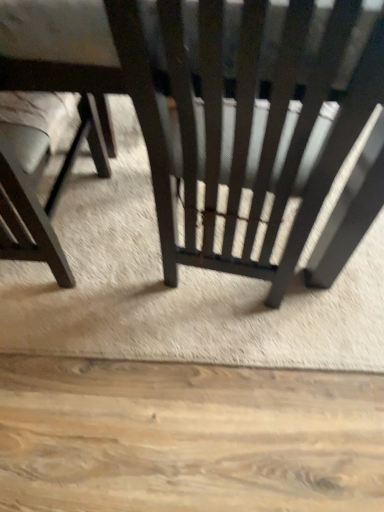
Where is `matte black chair at center, the 2th chair viewed from the left`? The image size is (384, 512). matte black chair at center, the 2th chair viewed from the left is located at coordinates (227, 110).

The height and width of the screenshot is (512, 384). What do you see at coordinates (227, 110) in the screenshot?
I see `matte black chair at center, the 1th chair positioned from the right` at bounding box center [227, 110].

Measure the distance between matte black chair at center, the 1th chair positioned from the right, and camera.

40.68 centimeters.

Where is `matte black chair at left, arranged as the 2th chair when viewed from the right`? This screenshot has width=384, height=512. matte black chair at left, arranged as the 2th chair when viewed from the right is located at coordinates (36, 185).

How much space does matte black chair at left, arranged as the 2th chair when viewed from the right, occupy vertically?

The height of matte black chair at left, arranged as the 2th chair when viewed from the right, is 56.40 centimeters.

What do you see at coordinates (36, 185) in the screenshot?
I see `matte black chair at left, the 1th chair from the left` at bounding box center [36, 185].

Find the location of a particular element. matte black chair at center, the 2th chair viewed from the left is located at coordinates (227, 110).

Is matte black chair at left, the 1th chair from the left, at the right side of matte black chair at center, the 1th chair positioned from the right?

No, matte black chair at left, the 1th chair from the left, is not to the right of matte black chair at center, the 1th chair positioned from the right.

Considering the relative positions of matte black chair at left, the 1th chair from the left, and matte black chair at center, the 2th chair viewed from the left, in the image provided, is matte black chair at left, the 1th chair from the left, behind matte black chair at center, the 2th chair viewed from the left,?

Yes, it is.

Does point (45, 237) appear closer or farther from the camera than point (35, 28)?

Clearly, point (45, 237) is more distant from the camera than point (35, 28).

From the image's perspective, who appears lower, matte black chair at left, the 1th chair from the left, or matte black chair at center, the 2th chair viewed from the left?

matte black chair at left, the 1th chair from the left, appears lower in the image.

From a real-world perspective, is matte black chair at left, arranged as the 2th chair when viewed from the right, positioned under matte black chair at center, the 1th chair positioned from the right, based on gravity?

Correct, in the physical world, matte black chair at left, arranged as the 2th chair when viewed from the right, is lower than matte black chair at center, the 1th chair positioned from the right.

In terms of width, does matte black chair at left, arranged as the 2th chair when viewed from the right, look wider or thinner when compared to matte black chair at center, the 1th chair positioned from the right?

matte black chair at left, arranged as the 2th chair when viewed from the right, is thinner than matte black chair at center, the 1th chair positioned from the right.

Based on the photo, in terms of height, does matte black chair at left, arranged as the 2th chair when viewed from the right, look taller or shorter compared to matte black chair at center, the 2th chair viewed from the left?

Clearly, matte black chair at left, arranged as the 2th chair when viewed from the right, is shorter compared to matte black chair at center, the 2th chair viewed from the left.

From the picture: Based on their sizes in the image, would you say matte black chair at left, arranged as the 2th chair when viewed from the right, is bigger or smaller than matte black chair at center, the 2th chair viewed from the left?

In the image, matte black chair at left, arranged as the 2th chair when viewed from the right, appears to be smaller than matte black chair at center, the 2th chair viewed from the left.

Is matte black chair at left, arranged as the 2th chair when viewed from the right, located outside matte black chair at center, the 2th chair viewed from the left?

No, matte black chair at left, arranged as the 2th chair when viewed from the right, is not entirely external to matte black chair at center, the 2th chair viewed from the left.

Is matte black chair at left, arranged as the 2th chair when viewed from the right, positioned far away from matte black chair at center, the 2th chair viewed from the left?

No, matte black chair at left, arranged as the 2th chair when viewed from the right, is in close proximity to matte black chair at center, the 2th chair viewed from the left.

Is matte black chair at left, the 1th chair from the left, positioned with its back to matte black chair at center, the 1th chair positioned from the right?

That's right, matte black chair at left, the 1th chair from the left, is facing away from matte black chair at center, the 1th chair positioned from the right.

This screenshot has height=512, width=384. Find the location of `chair below the matte black chair at center, the 1th chair positioned from the right (from the image's perspective)`. chair below the matte black chair at center, the 1th chair positioned from the right (from the image's perspective) is located at coordinates (36, 185).

Visually, is matte black chair at center, the 1th chair positioned from the right, positioned to the left or to the right of matte black chair at left, arranged as the 2th chair when viewed from the right?

matte black chair at center, the 1th chair positioned from the right, is to the right of matte black chair at left, arranged as the 2th chair when viewed from the right.

Is matte black chair at center, the 2th chair viewed from the left, further to the viewer compared to matte black chair at left, the 1th chair from the left?

That is False.

Is point (9, 37) more distant than point (90, 128)?

That is False.

From the image's perspective, between matte black chair at center, the 1th chair positioned from the right, and matte black chair at left, arranged as the 2th chair when viewed from the right, which one is located above?

From the image's view, matte black chair at center, the 1th chair positioned from the right, is above.

From a real-world perspective, who is located higher, matte black chair at center, the 1th chair positioned from the right, or matte black chair at left, arranged as the 2th chair when viewed from the right?

From a 3D spatial view, matte black chair at center, the 1th chair positioned from the right, is above.

Considering the sizes of objects matte black chair at center, the 1th chair positioned from the right, and matte black chair at left, the 1th chair from the left, in the image provided, who is thinner, matte black chair at center, the 1th chair positioned from the right, or matte black chair at left, the 1th chair from the left,?

Thinner between the two is matte black chair at left, the 1th chair from the left.

Considering the sizes of objects matte black chair at center, the 1th chair positioned from the right, and matte black chair at left, arranged as the 2th chair when viewed from the right, in the image provided, who is taller, matte black chair at center, the 1th chair positioned from the right, or matte black chair at left, arranged as the 2th chair when viewed from the right,?

matte black chair at center, the 1th chair positioned from the right.

Does matte black chair at center, the 1th chair positioned from the right, have a smaller size compared to matte black chair at left, the 1th chair from the left?

No.

Would you say matte black chair at center, the 2th chair viewed from the left, contains matte black chair at left, arranged as the 2th chair when viewed from the right?

Indeed, matte black chair at left, arranged as the 2th chair when viewed from the right, is located within matte black chair at center, the 2th chair viewed from the left.

Is there a large distance between matte black chair at center, the 1th chair positioned from the right, and matte black chair at left, the 1th chair from the left?

No, matte black chair at center, the 1th chair positioned from the right, is not far away from matte black chair at left, the 1th chair from the left.

Does matte black chair at center, the 2th chair viewed from the left, turn towards matte black chair at left, the 1th chair from the left?

Yes, matte black chair at center, the 2th chair viewed from the left, is aimed at matte black chair at left, the 1th chair from the left.

How many degrees apart are the facing directions of matte black chair at center, the 2th chair viewed from the left, and matte black chair at left, arranged as the 2th chair when viewed from the right?

There is a 179-degree angle between the facing directions of matte black chair at center, the 2th chair viewed from the left, and matte black chair at left, arranged as the 2th chair when viewed from the right.

Where is `chair on the right side of matte black chair at left, arranged as the 2th chair when viewed from the right`? This screenshot has height=512, width=384. chair on the right side of matte black chair at left, arranged as the 2th chair when viewed from the right is located at coordinates (227, 110).

You are a GUI agent. You are given a task and a screenshot of the screen. Output one action in this format:
    pyautogui.click(x=<x>, y=<y>)
    Task: Click on the chair in front of the matte black chair at left, arranged as the 2th chair when viewed from the right
    This screenshot has width=384, height=512.
    Given the screenshot: What is the action you would take?
    pyautogui.click(x=227, y=110)

This screenshot has width=384, height=512. Identify the location of chair behind the matte black chair at center, the 2th chair viewed from the left. (x=36, y=185).